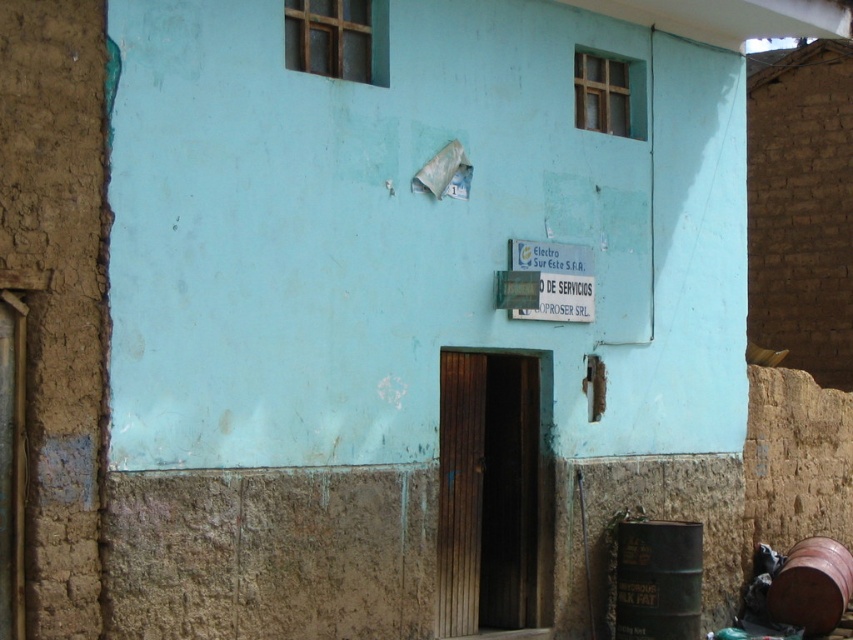
You are a delivery person trying to place a new barrel next to the existing barrels at the lower right. The new barrel is heavier and needs to be placed on a stable surface. Which barrel should you place it on top of, the green metallic barrel at lower right or the brown matte barrel at lower right?

The green metallic barrel at lower right is positioned over brown matte barrel at lower right, so the brown matte barrel at lower right is the one on the bottom and more stable. Place the new barrel on the brown matte barrel at lower right.